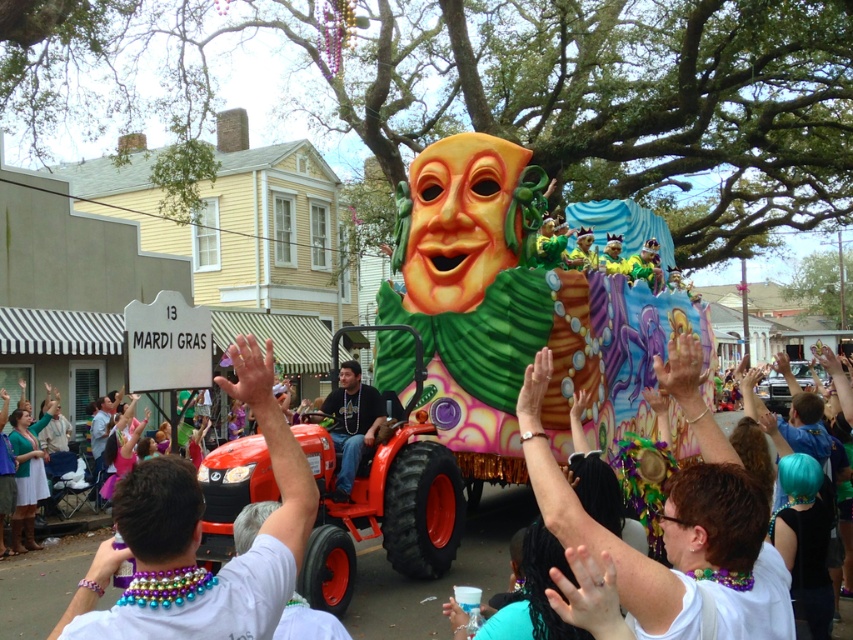
Question: Does shiny plastic mask at center lie behind white beaded necklace at center?

Choices:
 (A) no
 (B) yes

Answer: (B)

Question: Among these points, which one is farthest from the camera?

Choices:
 (A) (184, 536)
 (B) (523, 356)

Answer: (B)

Question: Which of the following is the closest to the observer?

Choices:
 (A) matte black shirt at center
 (B) white beaded necklace at center
 (C) shiny plastic mask at center

Answer: (B)

Question: Is shiny plastic mask at center thinner than white beaded necklace at center?

Choices:
 (A) no
 (B) yes

Answer: (A)

Question: Among these points, which one is nearest to the camera?

Choices:
 (A) (352, 392)
 (B) (247, 637)

Answer: (B)

Question: Is shiny plastic mask at center positioned before matte black shirt at center?

Choices:
 (A) yes
 (B) no

Answer: (A)